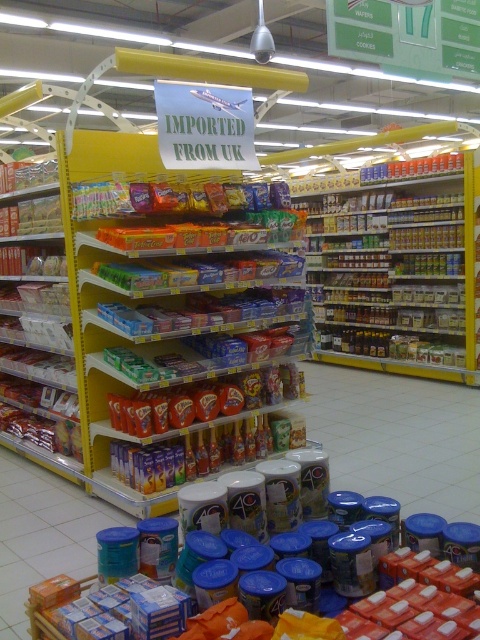
Between metallic silver spice jars at center and matte plastic snack at left, which one appears on the right side from the viewer's perspective?

metallic silver spice jars at center is more to the right.

Does metallic silver spice jars at center have a larger size compared to matte plastic snack at left?

Indeed, metallic silver spice jars at center has a larger size compared to matte plastic snack at left.

Does point (370, 305) lie behind point (48, 264)?

Yes, it is.

Identify the location of metallic silver spice jars at center. This screenshot has height=640, width=480. (394, 269).

Is point (468, 296) more distant than point (71, 604)?

Yes, it is.

Can you confirm if metallic silver spice jars at center is bigger than blue plastic canister at lower center?

Yes, metallic silver spice jars at center is bigger than blue plastic canister at lower center.

Where is `metallic silver spice jars at center`? metallic silver spice jars at center is located at coordinates (394, 269).

Is shiny plastic candy at center to the right of metallic silver spice jars at center from the viewer's perspective?

Incorrect, shiny plastic candy at center is not on the right side of metallic silver spice jars at center.

Is shiny plastic candy at center above metallic silver spice jars at center?

No, shiny plastic candy at center is not above metallic silver spice jars at center.

Where is `shiny plastic candy at center`? shiny plastic candy at center is located at coordinates (187, 323).